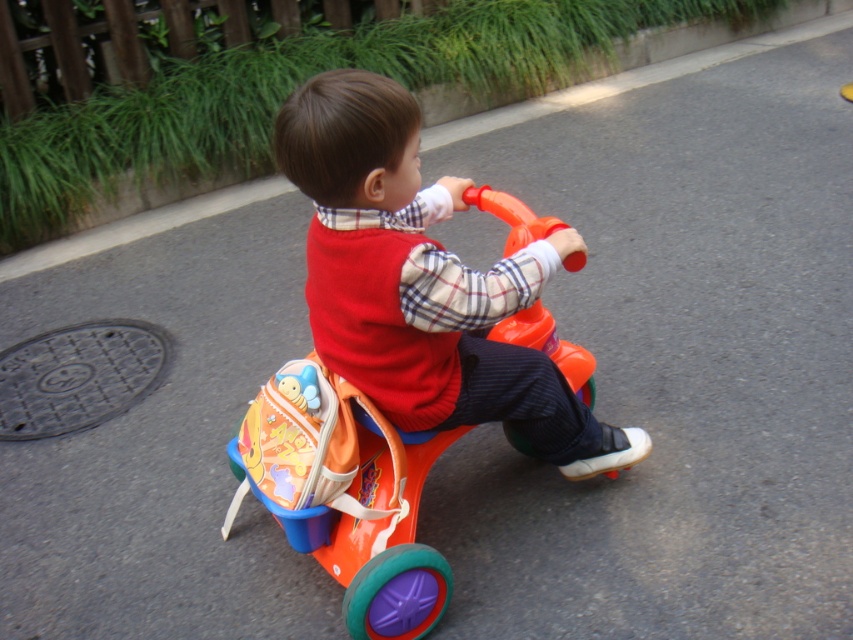
Consider the image. Can you confirm if matte orange plastic tricycle at center is positioned below orange plastic tricycle at center?

No.

The image size is (853, 640). What do you see at coordinates (422, 282) in the screenshot?
I see `matte orange plastic tricycle at center` at bounding box center [422, 282].

Does point (403, 371) lie in front of point (369, 474)?

Yes.

Where is `matte orange plastic tricycle at center`? This screenshot has width=853, height=640. matte orange plastic tricycle at center is located at coordinates (422, 282).